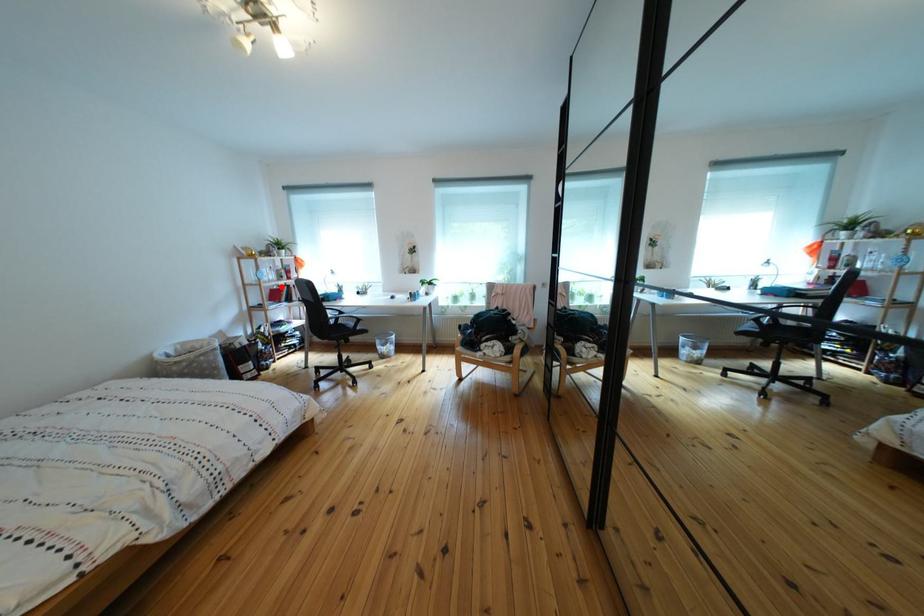
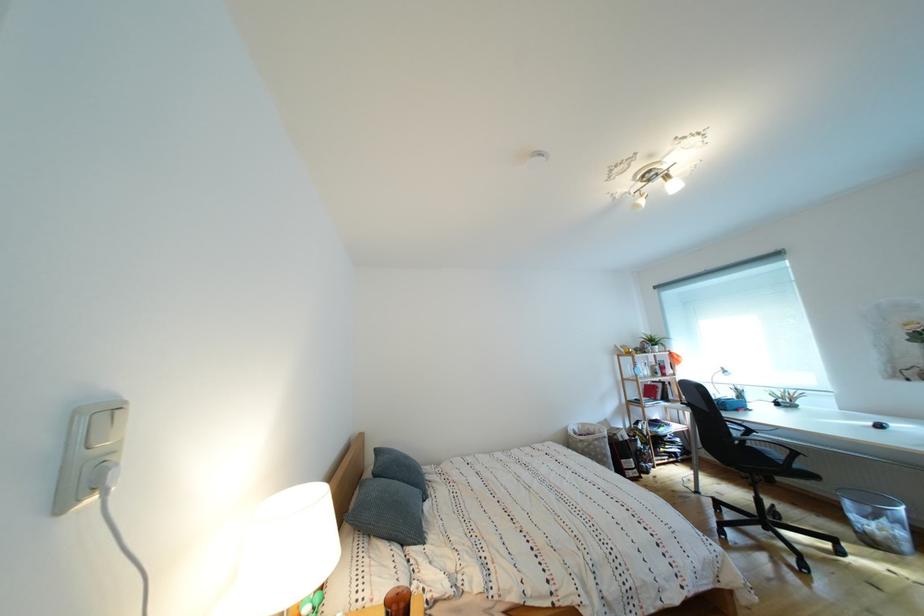
Where in the second image is the point corresponding to the highlighted location from the first image?

(657, 383)